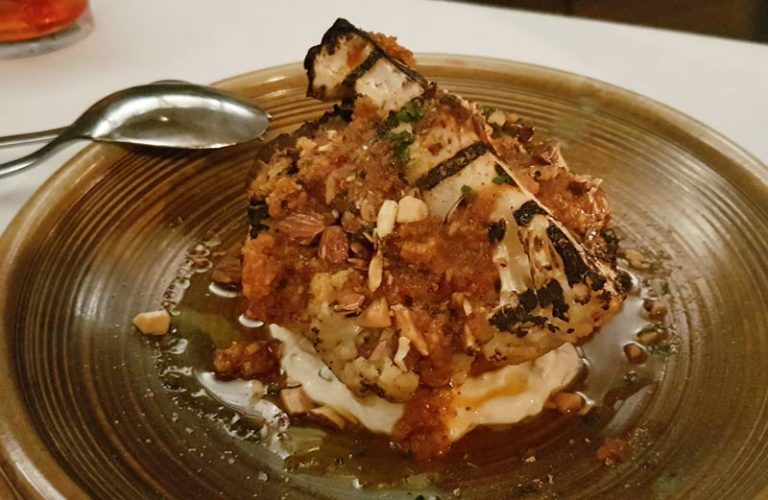
Identify the location of spoon handle. This screenshot has width=768, height=500. (22, 161).